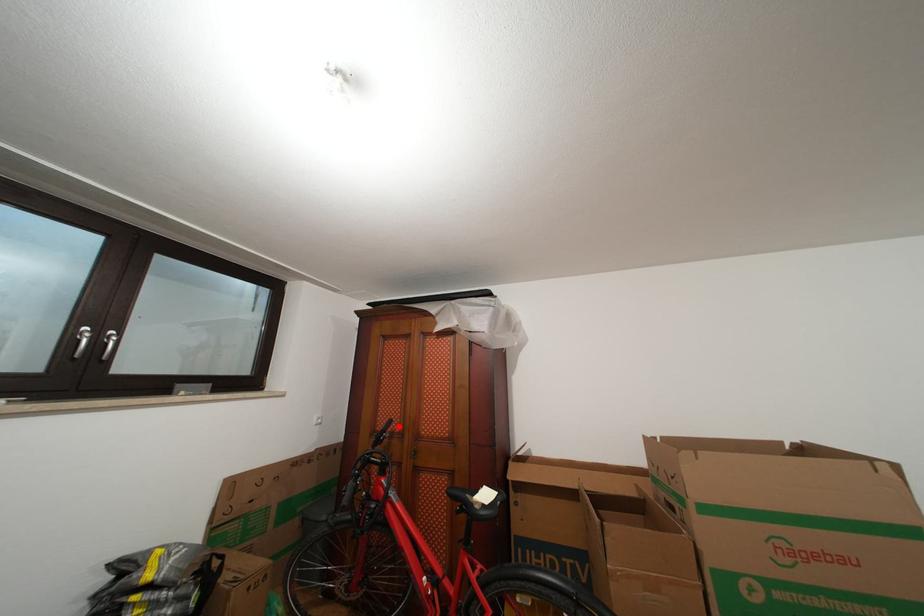
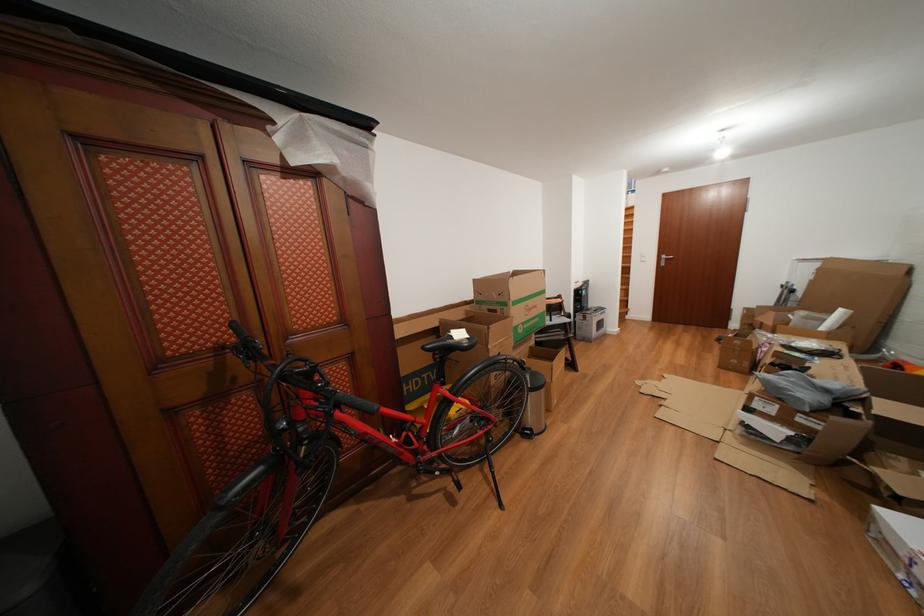
Question: I am providing you with two images of the same scene from different viewpoints. Image1 has a red point marked. In image2, the corresponding 3D location appears at what relative position? Reply with the corresponding letter.

Choices:
 (A) Closer
 (B) Farther

Answer: (A)